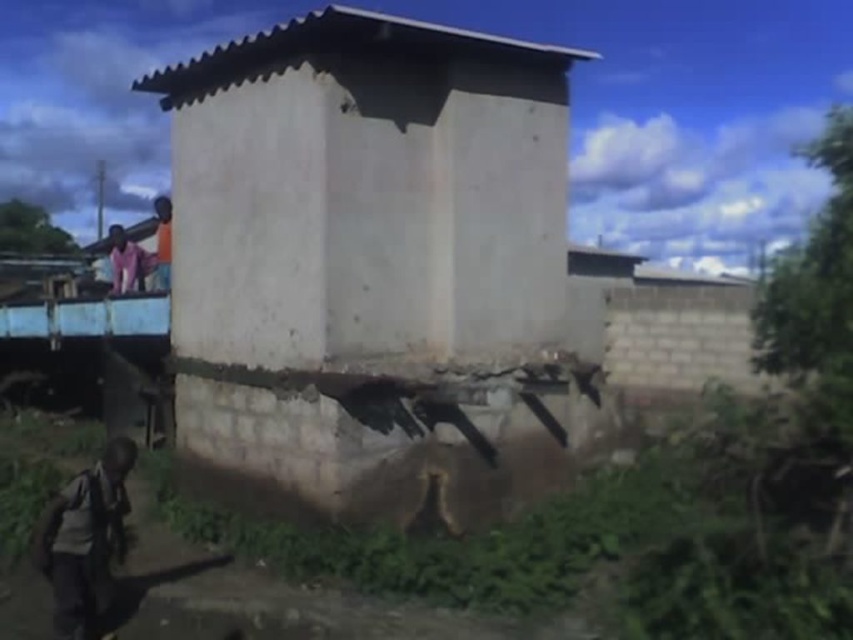
Question: Does dark gray backpack at lower left appear on the right side of pink fabric at upper left?

Choices:
 (A) no
 (B) yes

Answer: (B)

Question: Is dark gray backpack at lower left above pink fabric at upper left?

Choices:
 (A) yes
 (B) no

Answer: (B)

Question: Which of the following is the farthest from the observer?

Choices:
 (A) (119, 276)
 (B) (83, 496)

Answer: (A)

Question: Which of the following is the closest to the observer?

Choices:
 (A) pink fabric at upper left
 (B) dark gray backpack at lower left

Answer: (B)

Question: Is white concrete hut at center thinner than dark gray backpack at lower left?

Choices:
 (A) no
 (B) yes

Answer: (A)

Question: Which point is farther to the camera?

Choices:
 (A) (219, 166)
 (B) (82, 577)
 (C) (120, 275)

Answer: (C)